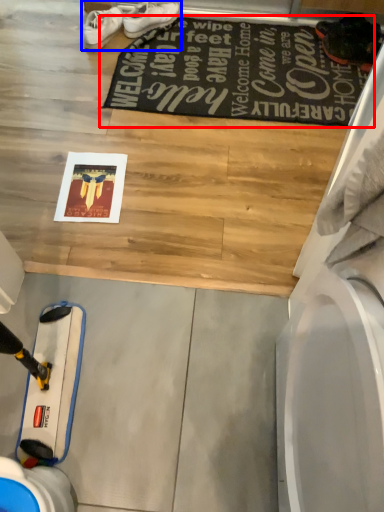
Question: Among these objects, which one is farthest to the camera, mat (highlighted by a red box) or footwear (highlighted by a blue box)?

Choices:
 (A) mat
 (B) footwear

Answer: (B)